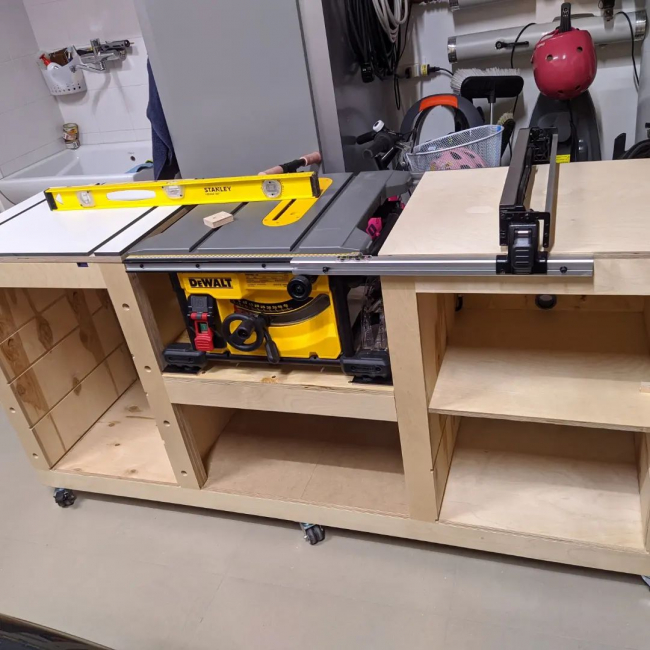
The height and width of the screenshot is (650, 650). What are the coordinates of `workbench` in the screenshot? It's located at (413, 227).